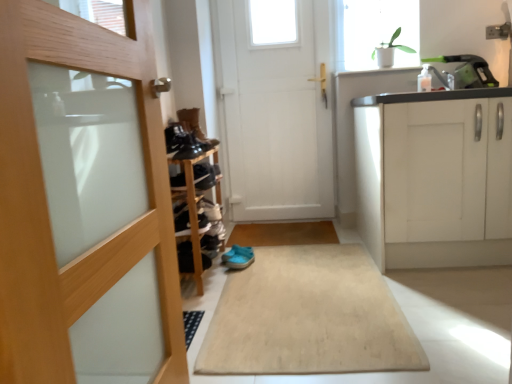
The width and height of the screenshot is (512, 384). What are the coordinates of `vacant location below white matte door at center, the 1th door viewed from the back (from a real-world perspective)` in the screenshot? It's located at (286, 216).